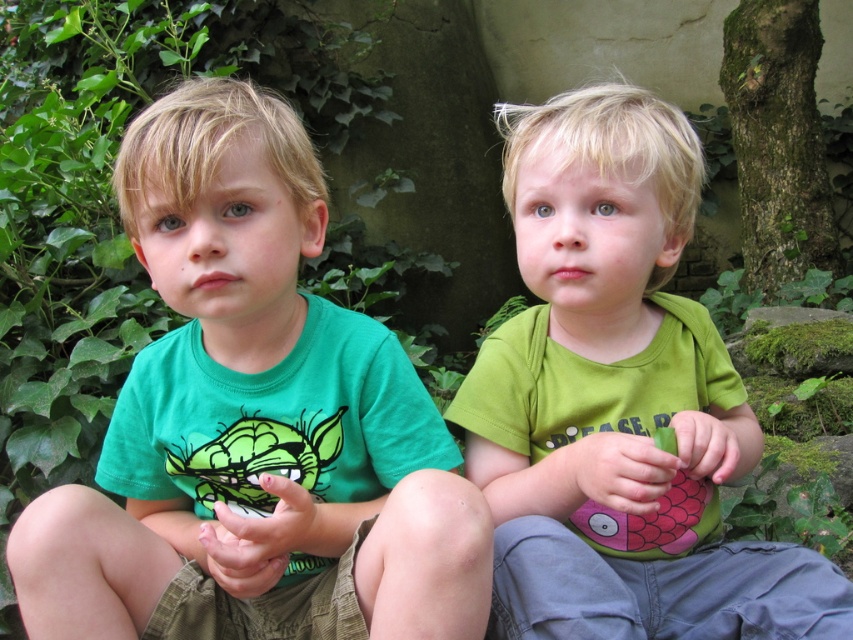
Looking at this image, which of these two, green matte t-shirt at left or green matte shirt at center, stands shorter?

green matte t-shirt at left is shorter.

Is point (375, 604) farther from camera compared to point (646, 612)?

No, (375, 604) is closer to viewer.

Who is more distant from viewer, (239,465) or (761,628)?

The point (239,465) is behind.

Locate an element on the screen. green matte t-shirt at left is located at coordinates [x=253, y=422].